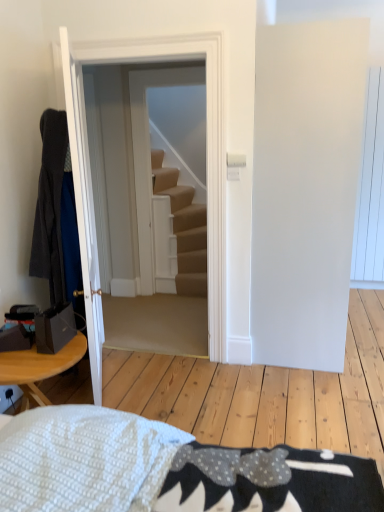
Question: Can carpeted stairs at center be found inside white wooden door at center, the first door viewed from the right?

Choices:
 (A) yes
 (B) no

Answer: (B)

Question: Can you confirm if white wooden door at center, which appears as the 2th door when viewed from the left, is shorter than carpeted stairs at center?

Choices:
 (A) no
 (B) yes

Answer: (B)

Question: Could you tell me if white wooden door at center, which appears as the 2th door when viewed from the left, is turned towards carpeted stairs at center?

Choices:
 (A) yes
 (B) no

Answer: (A)

Question: Is white wooden door at center, the first door viewed from the right, not near carpeted stairs at center?

Choices:
 (A) yes
 (B) no

Answer: (A)

Question: Is the position of white wooden door at center, which appears as the 2th door when viewed from the left, less distant than that of carpeted stairs at center?

Choices:
 (A) yes
 (B) no

Answer: (A)

Question: From a real-world perspective, is white wooden door at center, which appears as the 2th door when viewed from the left, positioned above or below white glossy door at left, the first door positioned from the left?

Choices:
 (A) above
 (B) below

Answer: (A)

Question: Is white wooden door at center, the first door viewed from the right, in front of or behind white glossy door at left, the 2th door when ordered from right to left, in the image?

Choices:
 (A) front
 (B) behind

Answer: (B)

Question: Is white wooden door at center, which appears as the 2th door when viewed from the left, wider or thinner than white glossy door at left, the first door positioned from the left?

Choices:
 (A) thin
 (B) wide

Answer: (B)

Question: From the image's perspective, is white wooden door at center, the first door viewed from the right, above or below white glossy door at left, the 2th door when ordered from right to left?

Choices:
 (A) above
 (B) below

Answer: (A)

Question: Considering the relative positions of white glossy door at left, the 2th door when ordered from right to left, and white wooden door at center, which appears as the 2th door when viewed from the left, in the image provided, is white glossy door at left, the 2th door when ordered from right to left, to the left or to the right of white wooden door at center, which appears as the 2th door when viewed from the left,?

Choices:
 (A) right
 (B) left

Answer: (B)

Question: Is point (87, 142) closer or farther from the camera than point (208, 242)?

Choices:
 (A) farther
 (B) closer

Answer: (B)

Question: In the image, is white glossy door at left, the 2th door when ordered from right to left, positioned in front of or behind white wooden door at center, the first door viewed from the right?

Choices:
 (A) behind
 (B) front

Answer: (B)

Question: In terms of size, does white glossy door at left, the 2th door when ordered from right to left, appear bigger or smaller than white wooden door at center, the first door viewed from the right?

Choices:
 (A) small
 (B) big

Answer: (A)

Question: From the image's perspective, is carpeted stairs at center positioned above or below dark gray fabric robe at left?

Choices:
 (A) below
 (B) above

Answer: (B)

Question: Is point (173, 231) positioned closer to the camera than point (52, 138)?

Choices:
 (A) closer
 (B) farther

Answer: (B)